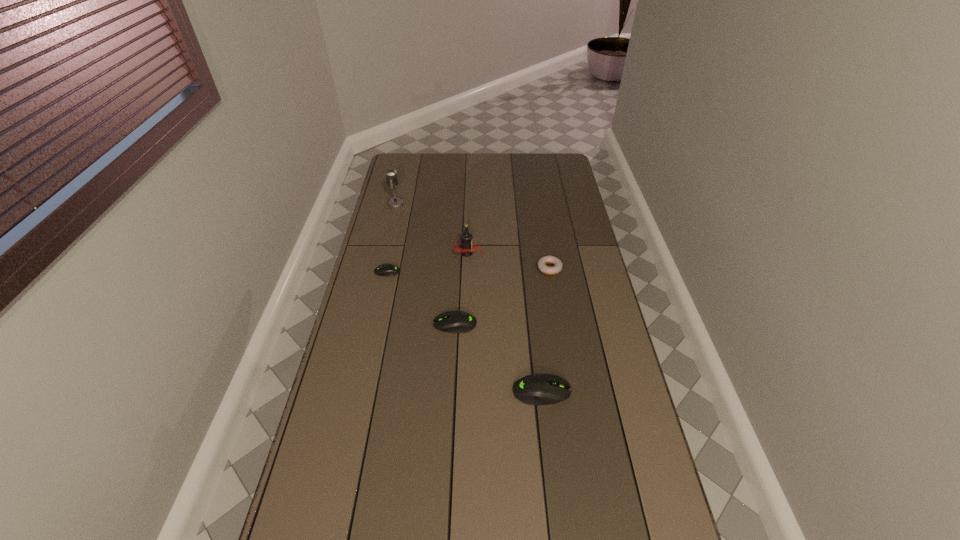
This screenshot has width=960, height=540. I want to click on the leftmost computer mouse, so click(x=388, y=270).

What are the coordinates of `the shortest computer mouse` in the screenshot? It's located at (388, 270).

This screenshot has height=540, width=960. In order to click on the fourth tallest object in this screenshot , I will do `click(456, 321)`.

This screenshot has width=960, height=540. Identify the location of the second nearest computer mouse. (456, 321).

At what (x,y) coordinates should I click in order to perform the action: click on the nearest computer mouse. Please return your answer as a coordinate pair (x, y). Image resolution: width=960 pixels, height=540 pixels. Looking at the image, I should click on (536, 389).

At what (x,y) coordinates should I click in order to perform the action: click on the nearest object. Please return your answer as a coordinate pair (x, y). Looking at the image, I should click on (536, 389).

Where is `the second tallest object`? The image size is (960, 540). the second tallest object is located at coordinates (466, 243).

Locate an element on the screen. The image size is (960, 540). microphone is located at coordinates (391, 174).

Locate an element on the screen. The height and width of the screenshot is (540, 960). the farthest object is located at coordinates (391, 174).

This screenshot has height=540, width=960. Find the location of `doughnut`. doughnut is located at coordinates (542, 262).